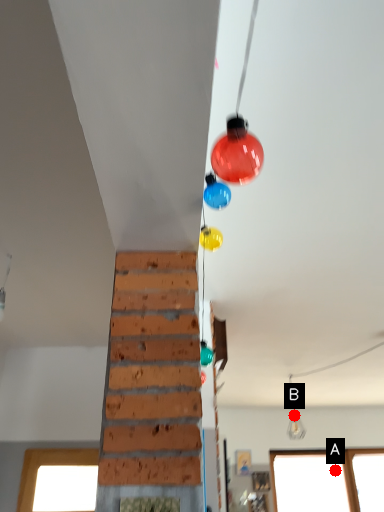
Question: Two points are circled on the image, labeled by A and B beside each circle. Which point appears farthest from the camera in this image?

Choices:
 (A) A is further
 (B) B is further

Answer: (B)